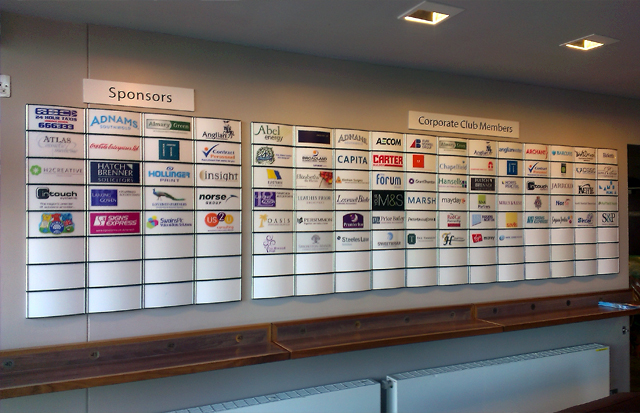
Identify the location of black floor. (625, 399).